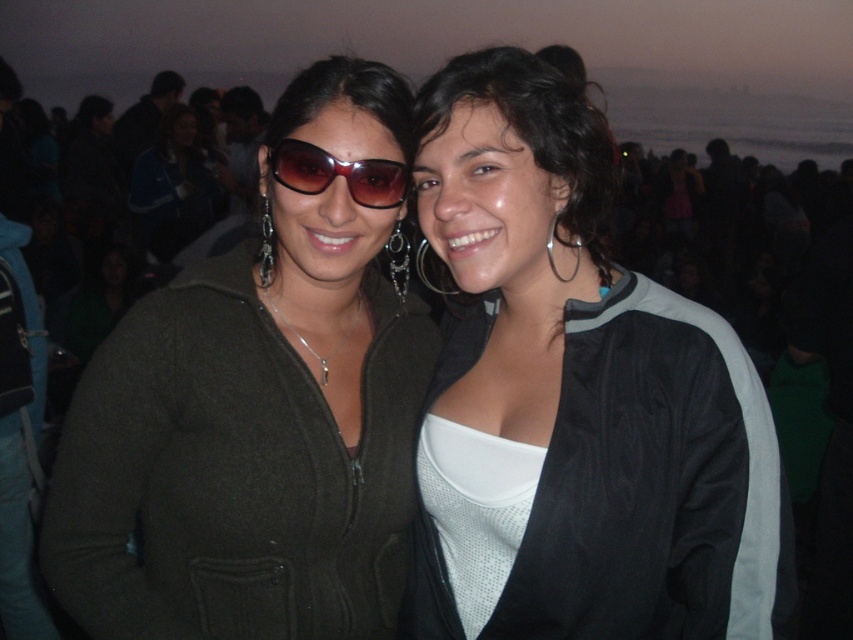
Question: Does black fabric jacket at center have a lesser width compared to dark brown hair at center?

Choices:
 (A) no
 (B) yes

Answer: (A)

Question: Which object is positioned farthest from the black fabric jacket at center?

Choices:
 (A) sunglasses at center
 (B) dark brown hair at center
 (C) matte black jacket at center

Answer: (A)

Question: Which point is farther to the camera?

Choices:
 (A) black fabric jacket at center
 (B) dark brown hair at center
 (C) sunglasses at center
 (D) matte black jacket at center

Answer: (C)

Question: Is black fabric jacket at center to the left of matte black jacket at center from the viewer's perspective?

Choices:
 (A) yes
 (B) no

Answer: (B)

Question: Which object is farther from the camera taking this photo?

Choices:
 (A) sunglasses at center
 (B) black fabric jacket at center

Answer: (A)

Question: Is black fabric jacket at center positioned at the back of sunglasses at center?

Choices:
 (A) yes
 (B) no

Answer: (B)